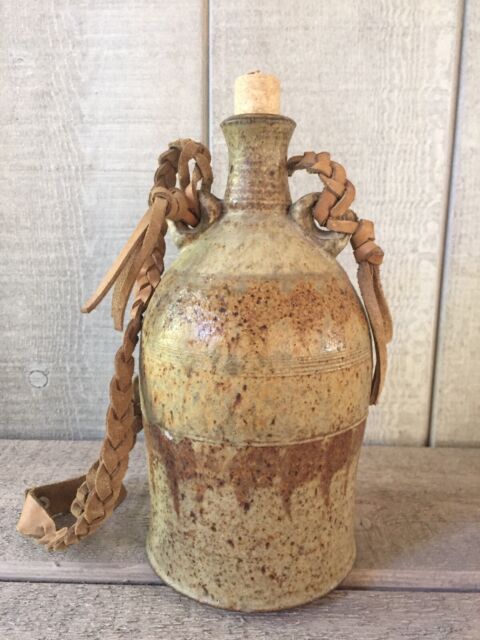
Locate an element on the screen. The width and height of the screenshot is (480, 640). ceramic is located at coordinates (271, 354).